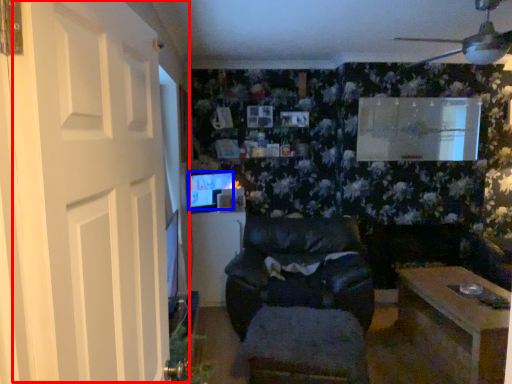
Question: Which object appears farthest to the camera in this image, door (highlighted by a red box) or computer monitor (highlighted by a blue box)?

Choices:
 (A) door
 (B) computer monitor

Answer: (B)